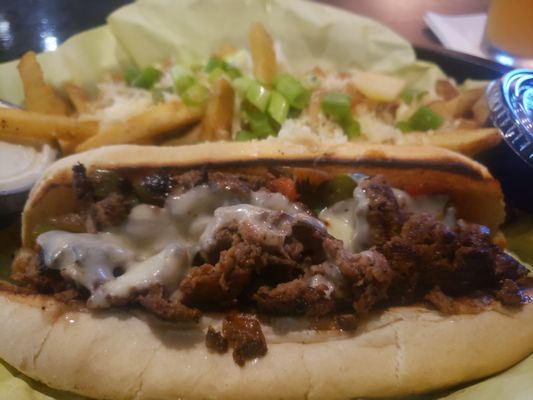
Locate an element on the screen. The width and height of the screenshot is (533, 400). table is located at coordinates pyautogui.click(x=407, y=13).